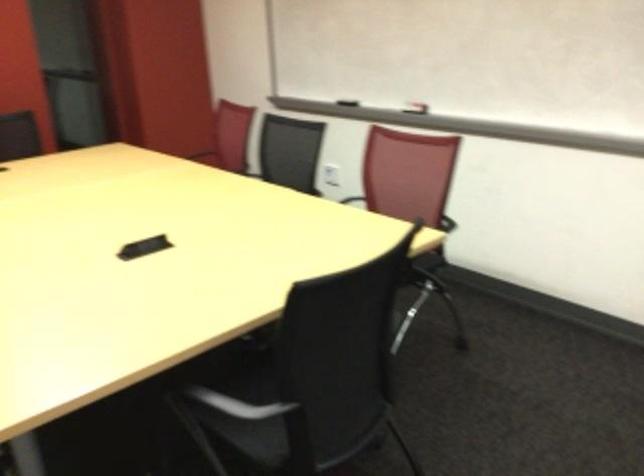
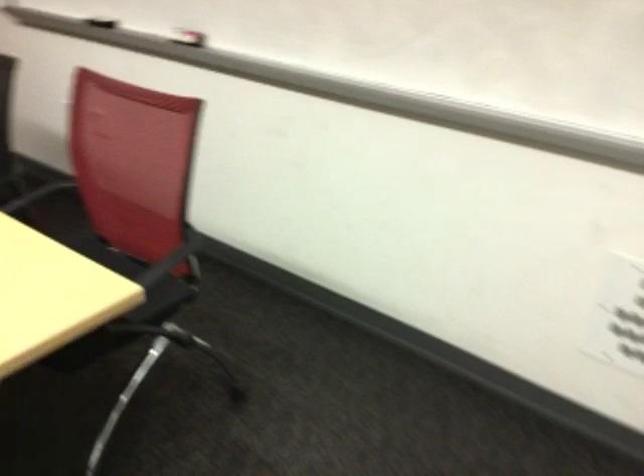
In the second image, find the point that corresponds to [348,100] in the first image.

(102, 21)